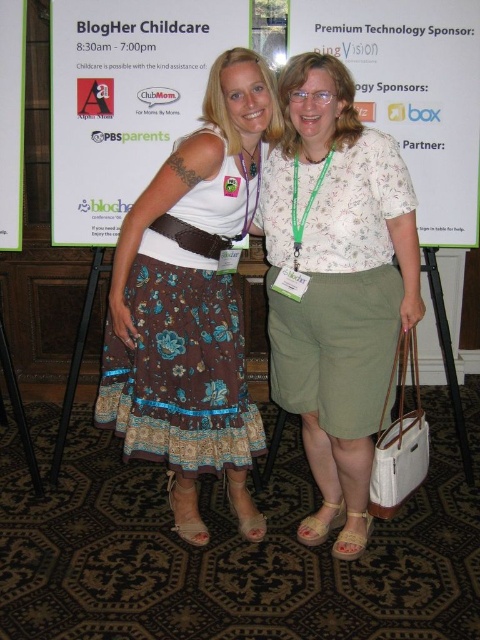
Does brown leather belt at center appear on the right side of tan leather sandal at lower center?

Incorrect, brown leather belt at center is not on the right side of tan leather sandal at lower center.

Which is more to the left, brown leather belt at center or tan leather sandal at lower center?

From the viewer's perspective, brown leather belt at center appears more on the left side.

Does point (187, 236) come closer to viewer compared to point (354, 554)?

Yes.

Find the location of `brown leather belt at center`. brown leather belt at center is located at coordinates (191, 236).

Can you confirm if brown floral skirt at left is positioned to the left of matte brown sandal at lower center?

No, brown floral skirt at left is not to the left of matte brown sandal at lower center.

Does point (243, 428) lie behind point (191, 513)?

That is False.

What do you see at coordinates (180, 365) in the screenshot? I see `brown floral skirt at left` at bounding box center [180, 365].

This screenshot has height=640, width=480. Identify the location of brown floral skirt at left. (180, 365).

Can you confirm if brown floral skirt at left is shorter than white paper at center?

No, brown floral skirt at left is not shorter than white paper at center.

Is brown floral skirt at left positioned in front of white paper at center?

Yes.

Identify the location of brown floral skirt at left. The image size is (480, 640). (180, 365).

At what (x,y) coordinates should I click in order to perform the action: click on brown floral skirt at left. Please return your answer as a coordinate pair (x, y). Looking at the image, I should click on (180, 365).